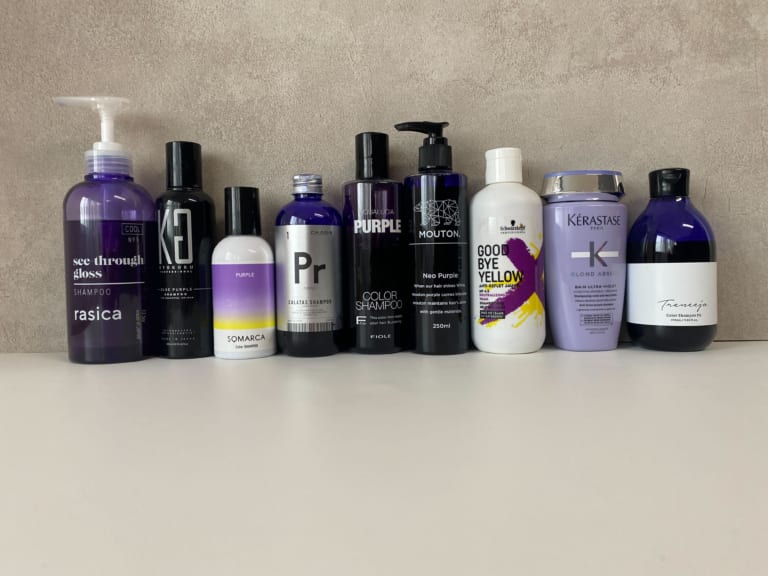
Locate an element on the screen. hair products on white surface is located at coordinates (690, 251), (581, 232), (495, 268), (434, 259), (371, 260), (319, 268), (243, 286), (181, 263), (107, 289).